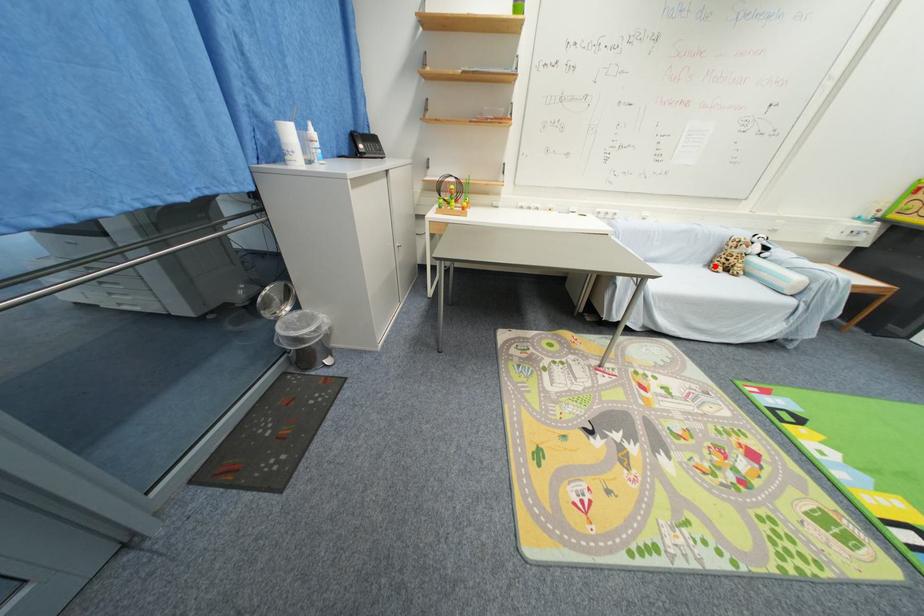
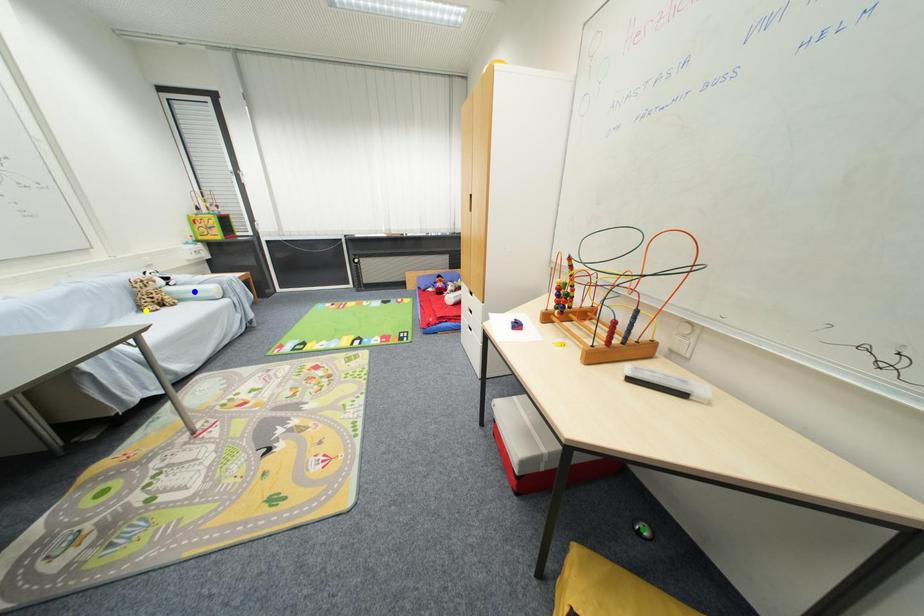
Question: I am providing you with two images of the same scene from different viewpoints. A red point is marked on the first image. You are given multiple points on the second image. Which spot in image 2 lines up with the point in image 1?

Choices:
 (A) green point
 (B) blue point
 (C) yellow point

Answer: (C)